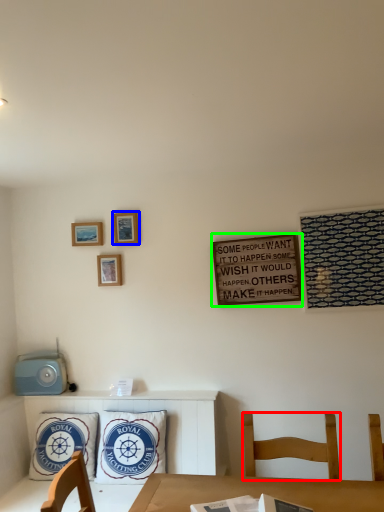
Question: Considering the real-world distances, which object is closest to chair (highlighted by a red box)? picture frame (highlighted by a blue box) or bulletin board (highlighted by a green box).

Choices:
 (A) picture frame
 (B) bulletin board

Answer: (B)